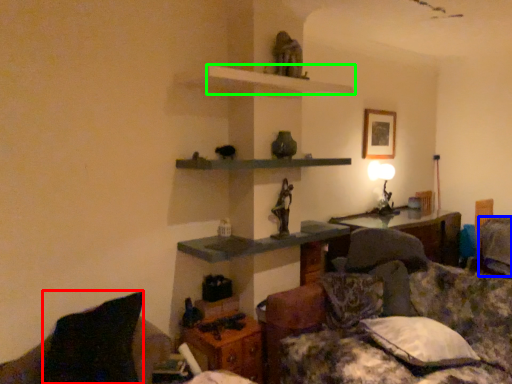
Question: Which object is positioned farthest from pillow (highlighted by a red box)? Select from pillow (highlighted by a blue box) and shelf (highlighted by a green box).

Choices:
 (A) pillow
 (B) shelf

Answer: (A)